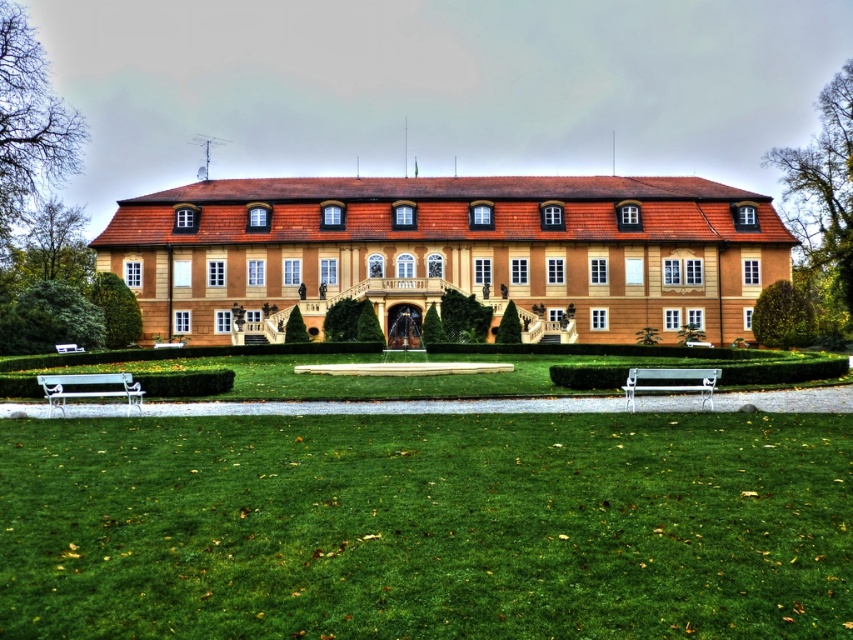
Is green grass at lower center above white metallic bench at lower center?

Incorrect, green grass at lower center is not positioned above white metallic bench at lower center.

I want to click on green grass at lower center, so click(427, 525).

Is point (453, 547) positioned behind point (642, 380)?

No, (453, 547) is closer to viewer.

Where is `green grass at lower center`? The height and width of the screenshot is (640, 853). green grass at lower center is located at coordinates (427, 525).

Which is more to the right, green grass at lower center or white painted wood bench at lower left?

Positioned to the right is green grass at lower center.

Can you confirm if green grass at lower center is positioned below white painted wood bench at lower left?

Yes, green grass at lower center is below white painted wood bench at lower left.

Find the location of a particular element. green grass at lower center is located at coordinates (427, 525).

Looking at this image, does white metallic bench at lower center lie in front of white painted wood bench at lower left?

No.

The width and height of the screenshot is (853, 640). What do you see at coordinates (670, 381) in the screenshot?
I see `white metallic bench at lower center` at bounding box center [670, 381].

The image size is (853, 640). What are the coordinates of `white metallic bench at lower center` in the screenshot? It's located at (670, 381).